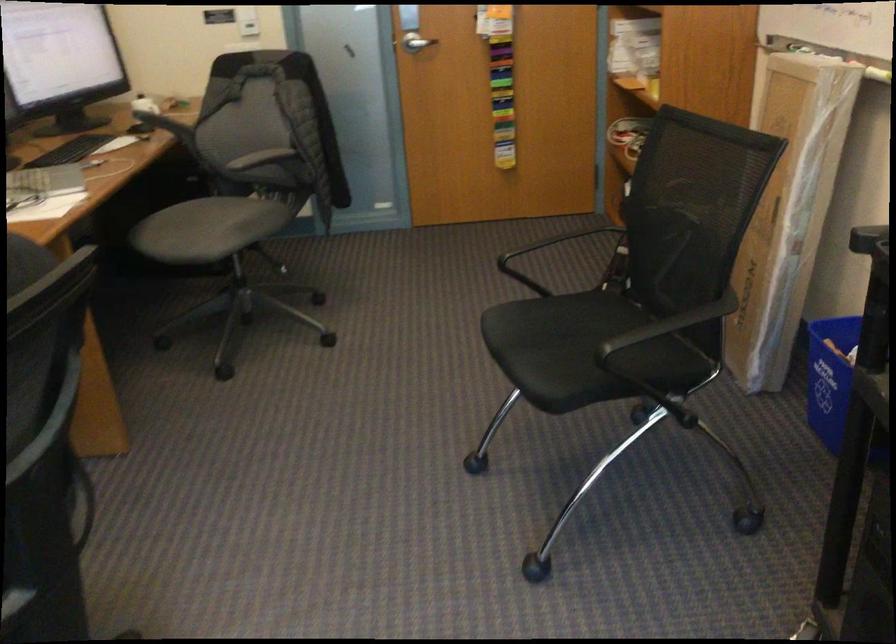
Where is `silver door handle`? Image resolution: width=896 pixels, height=644 pixels. silver door handle is located at coordinates (415, 43).